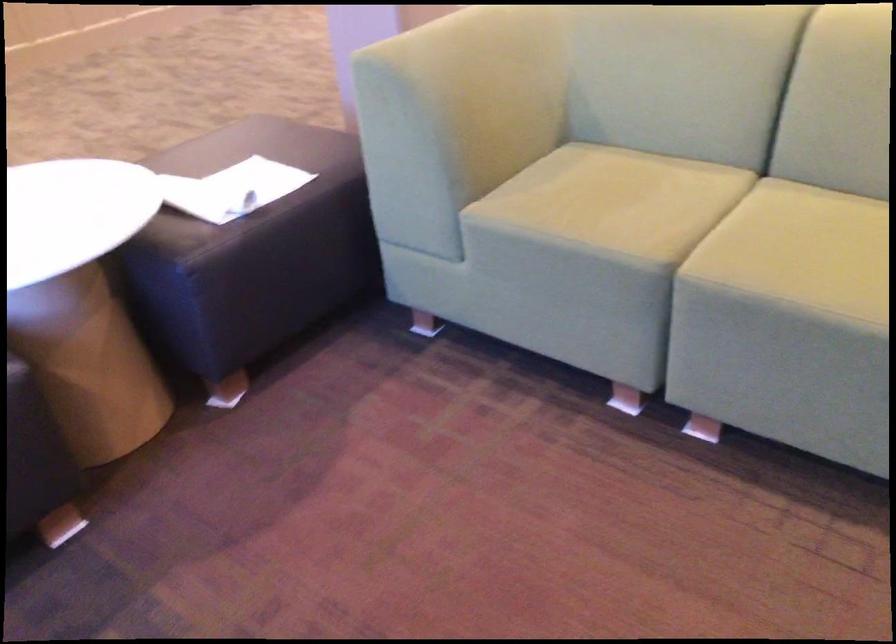
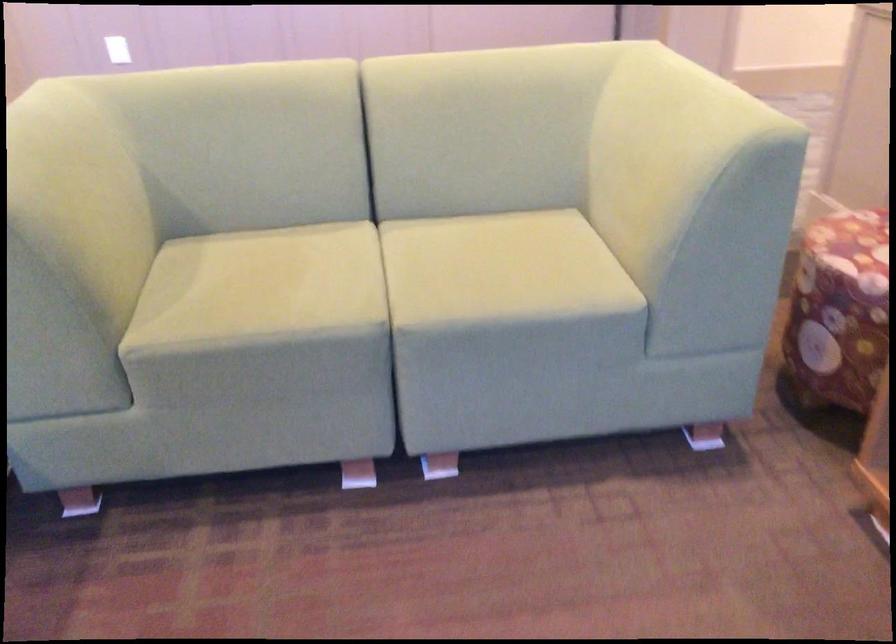
Locate, in the second image, the point that corresponds to pixel 622 194 in the first image.

(280, 277)